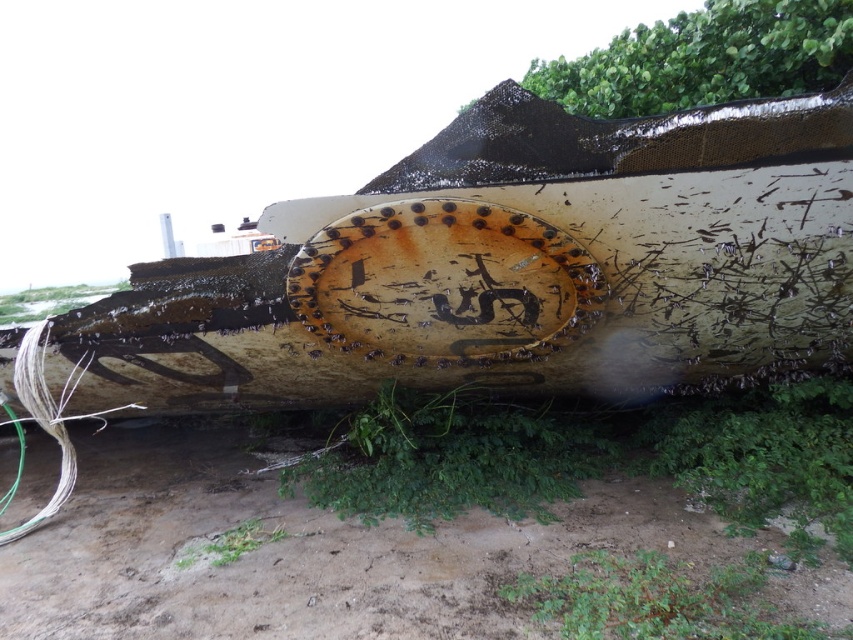
What is the position of the rusty metal boat at center relative to the dull brown dirt track at lower center?

The rusty metal boat at center is to the right of the dull brown dirt track at lower center.

In the scene shown: You are a photographer trying to capture the rusty metal boat at center and the dull brown dirt track at lower center in a single frame. Given their sizes, which object should you position closer to the camera to ensure both are fully visible in the photo?

Since the rusty metal boat at center is narrower than the dull brown dirt track at lower center, you should position the rusty metal boat at center closer to the camera to ensure both fit within the frame.